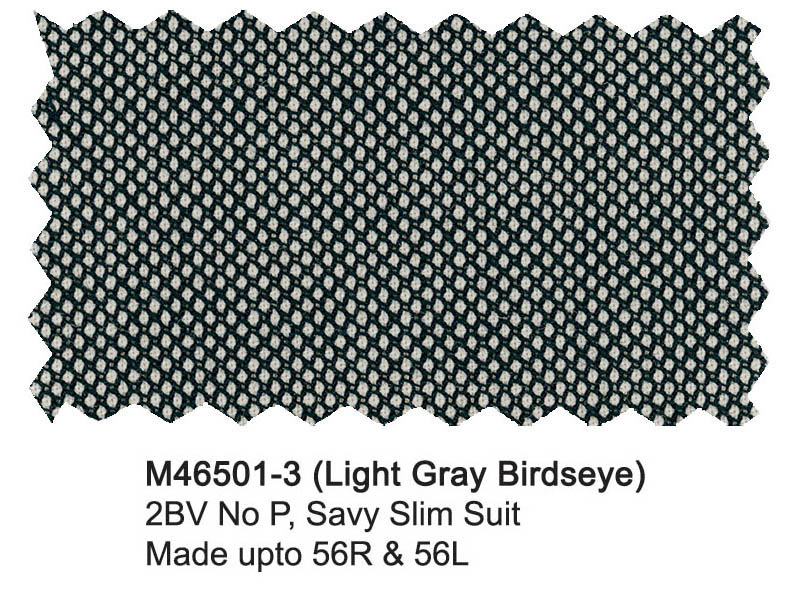
Image resolution: width=790 pixels, height=605 pixels. Find the location of `scales`. scales is located at coordinates (316, 194).